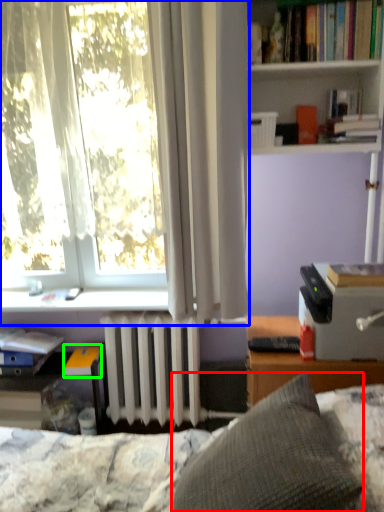
Question: Which object is positioned closest to pillow (highlighted by a red box)? Select from shelf (highlighted by a blue box) and book (highlighted by a green box).

Choices:
 (A) shelf
 (B) book

Answer: (A)